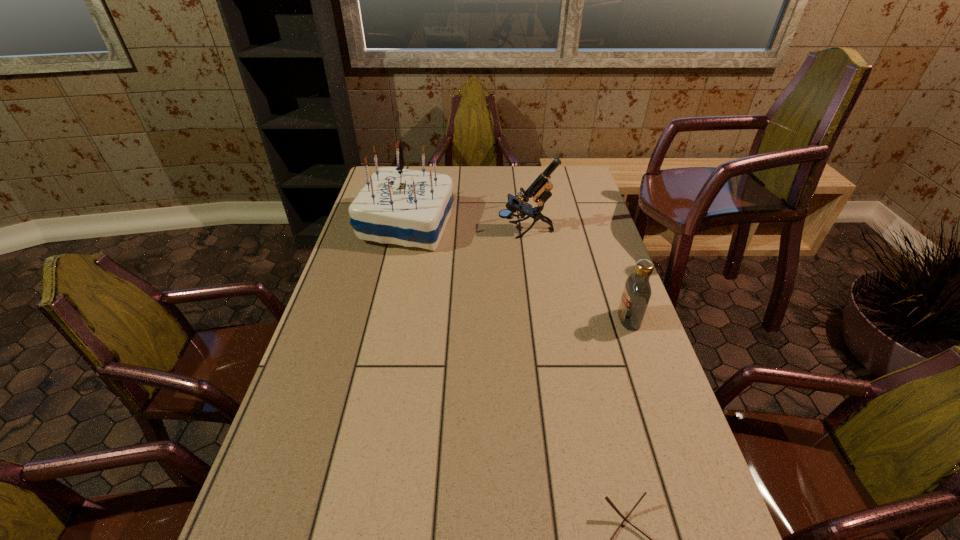
At what (x,y) coordinates should I click in order to perform the action: click on free spot between the birthday cake and the vodka. Please return your answer as a coordinate pair (x, y). The image size is (960, 540). Looking at the image, I should click on (517, 272).

You are a GUI agent. You are given a task and a screenshot of the screen. Output one action in this format:
    pyautogui.click(x=<x>, y=<y>)
    Task: Click on the free space between the microscope and the birthday cake
    This screenshot has height=540, width=960.
    Given the screenshot: What is the action you would take?
    pyautogui.click(x=467, y=227)

Select which object appears as the closest to the leftmost object. Please provide its 2D coordinates. Your answer should be formatted as a tuple, i.e. [(x, y)], where the tuple contains the x and y coordinates of a point satisfying the conditions above.

[(540, 189)]

Locate which object ranks in proximity to the spectacles. Please provide its 2D coordinates. Your answer should be formatted as a tuple, i.e. [(x, y)], where the tuple contains the x and y coordinates of a point satisfying the conditions above.

[(636, 295)]